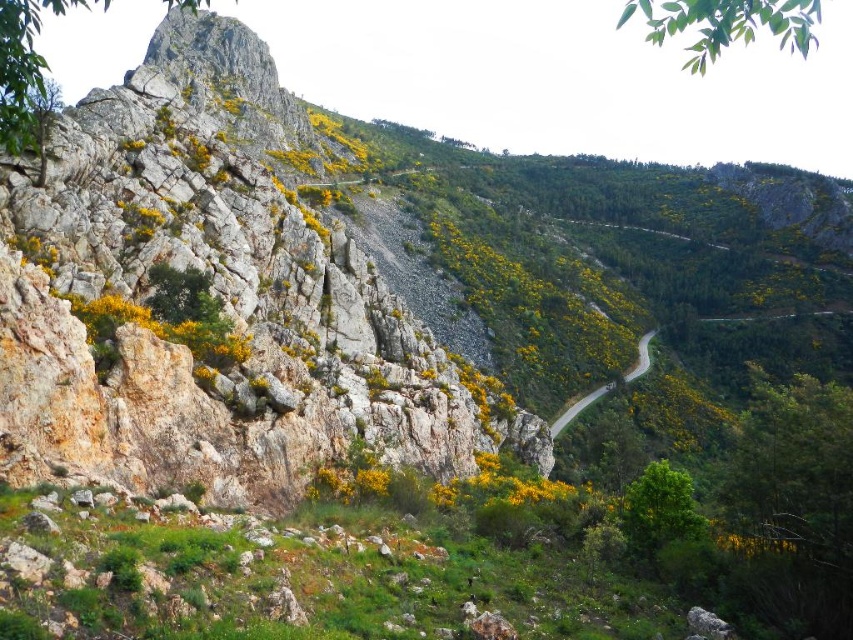
You are a hiker planning to cross the smooth asphalt road at center and then climb the rugged stone mountain at left. Which path requires more horizontal space for your equipment setup?

The rugged stone mountain at left requires more horizontal space for your equipment setup because its width surpasses that of the smooth asphalt road at center.

You are a hiker planning to climb the rugged stone mountain at left and then descend down the smooth asphalt road at center. Which part of the journey will require more physical effort?

The rugged stone mountain at left requires more physical effort because it has a greater height compared to the smooth asphalt road at center, making the ascent steeper and more challenging.